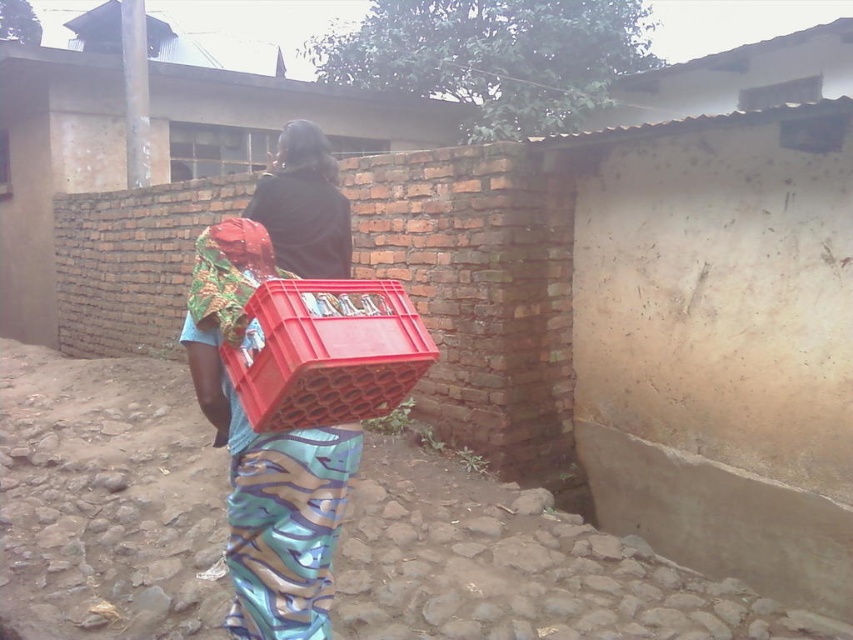
Question: Which of these objects is positioned closest to the dark brown hair at center?

Choices:
 (A) red plastic crate at center
 (B) matte plastic crate at center

Answer: (B)

Question: Is red plastic crate at center below dark brown hair at center?

Choices:
 (A) yes
 (B) no

Answer: (A)

Question: Is red plastic crate at center in front of dark brown hair at center?

Choices:
 (A) no
 (B) yes

Answer: (B)

Question: Which object appears farthest from the camera in this image?

Choices:
 (A) matte plastic crate at center
 (B) dark brown hair at center

Answer: (B)

Question: Based on their relative distances, which object is farther from the red plastic crate at center?

Choices:
 (A) matte plastic crate at center
 (B) dark brown hair at center

Answer: (B)

Question: Can you confirm if matte plastic crate at center is positioned to the right of red plastic crate at center?

Choices:
 (A) no
 (B) yes

Answer: (A)